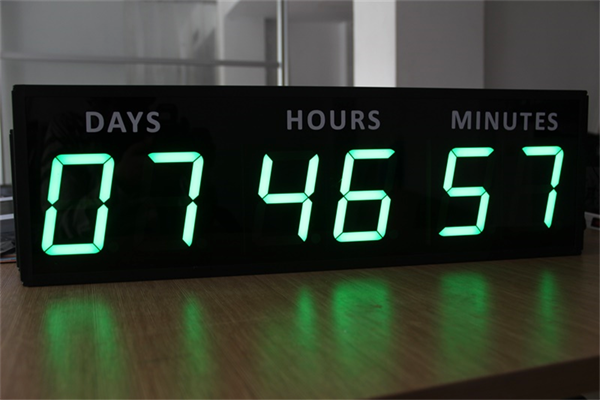
At what (x,y) coordinates should I click in order to perform the action: click on side of table. Please return your answer as a coordinate pair (x, y). The height and width of the screenshot is (400, 600). Looking at the image, I should click on (566, 368).